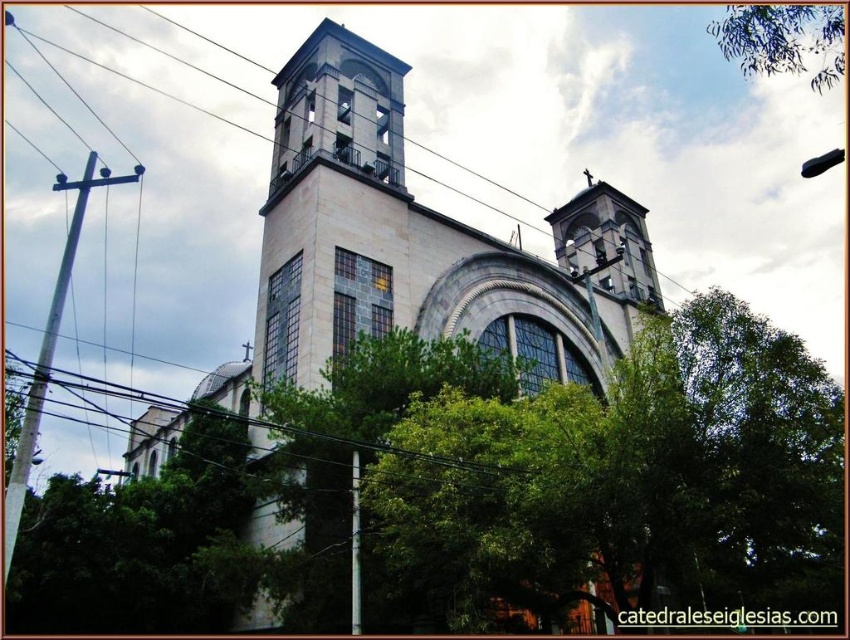
You are standing at the center of the image. Which direction should you move to get closer to the white stone church at center?

The white stone church at center is already at the center of the image, so you don not need to move in any direction to get closer.

You are a bird flying over the area and want to land on the tallest object between the white stone church at center and the green leafy tree at upper center. Which object should you choose?

The white stone church at center is much taller than the green leafy tree at upper center, so you should choose the white stone church at center to land on.

You are standing in front of the white stone church at center and the green leafy tree at upper center. Which object is positioned to the left when facing the scene?

The white stone church at center is positioned to the left of the green leafy tree at upper center.